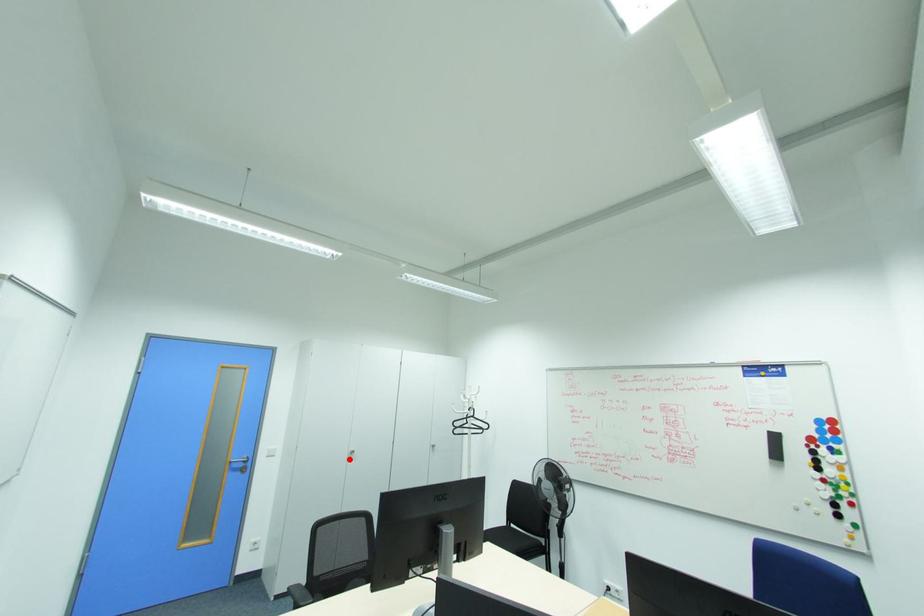
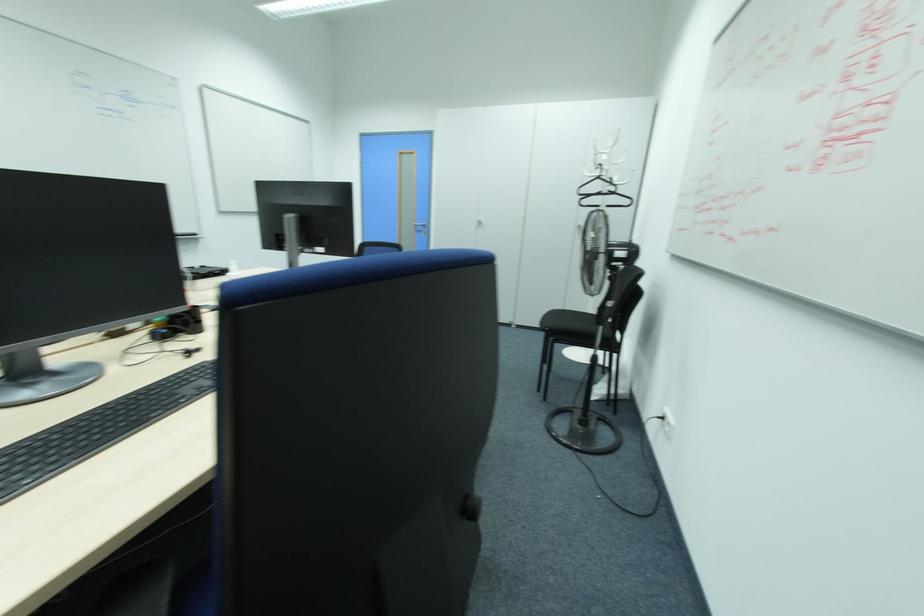
Where in the second image is the point corresponding to the highlighted location from the first image?

(479, 227)